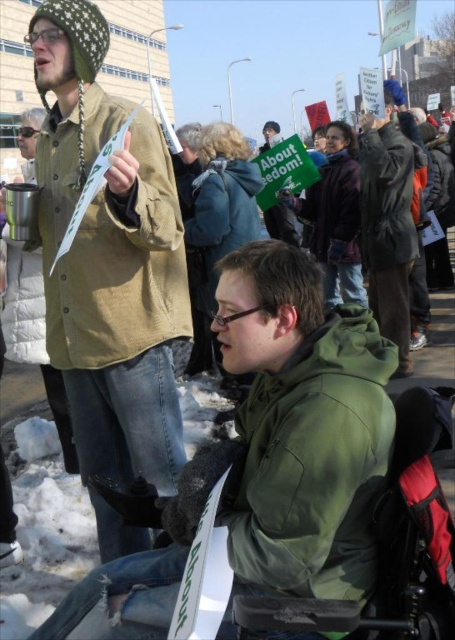
Question: Estimate the real-world distances between objects in this image. Which object is farther from the green paper sign at center?

Choices:
 (A) green quilted jacket at upper left
 (B) green matte jacket at center
 (C) dark gray jacket at center
 (D) tan canvas jacket at upper left

Answer: (B)

Question: Does matte brown jacket at upper left have a lesser width compared to green paper sign at center?

Choices:
 (A) yes
 (B) no

Answer: (B)

Question: Can you confirm if tan canvas jacket at upper left is wider than dark gray jacket at center?

Choices:
 (A) no
 (B) yes

Answer: (B)

Question: Considering the relative positions of tan canvas jacket at upper left and green quilted jacket at upper left in the image provided, where is tan canvas jacket at upper left located with respect to green quilted jacket at upper left?

Choices:
 (A) below
 (B) above

Answer: (B)

Question: Which of the following is the closest to the observer?

Choices:
 (A) tan canvas jacket at upper left
 (B) green paper sign at center

Answer: (A)

Question: Which of the following is the closest to the observer?

Choices:
 (A) (183, 291)
 (B) (363, 540)

Answer: (B)